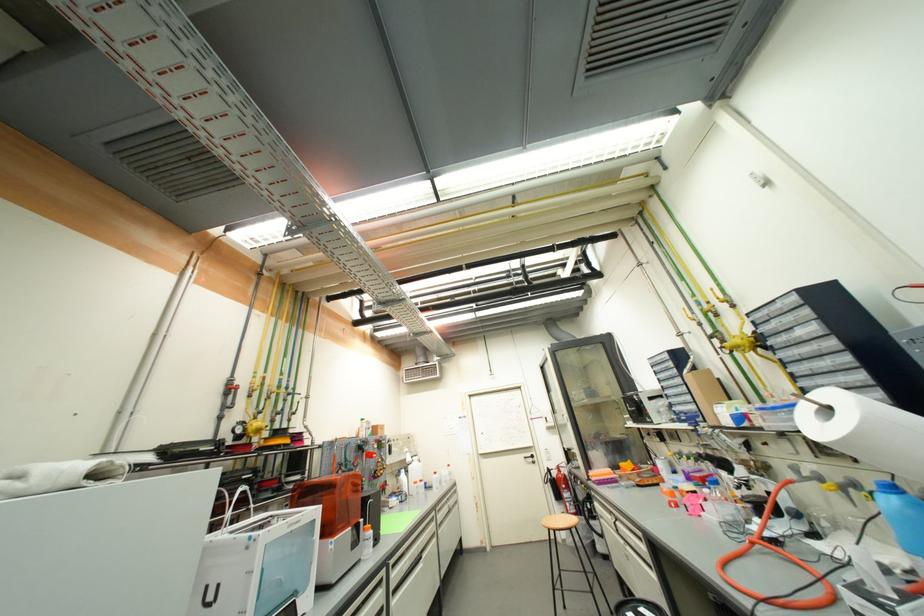
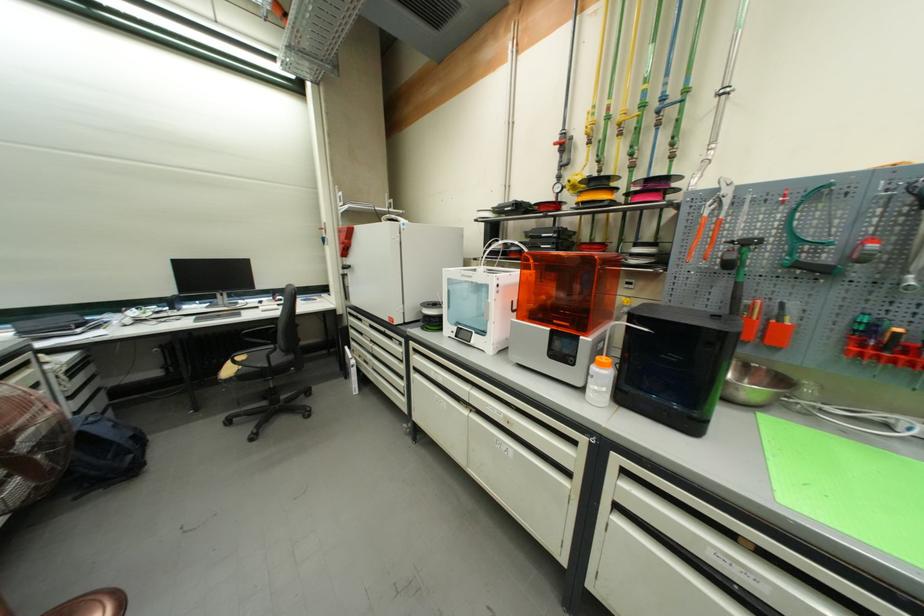
The point at (373, 532) is marked in the first image. Where is the corresponding point in the second image?

(606, 367)